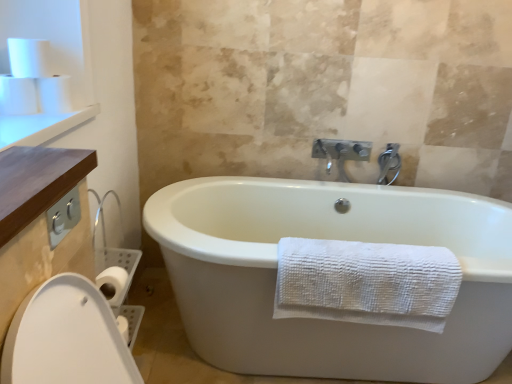
What do you see at coordinates (17, 96) in the screenshot?
I see `white matte toilet paper at upper left, placed as the third toilet paper when sorted from right to left` at bounding box center [17, 96].

In order to face white matte toilet paper at upper left, which is counted as the third toilet paper, starting from the left, should I rotate leftwards or rightwards?

It's best to rotate left around 24.949 degrees.

This screenshot has height=384, width=512. What do you see at coordinates (55, 94) in the screenshot?
I see `white matte toilet paper at upper left, which is counted as the third toilet paper, starting from the left` at bounding box center [55, 94].

Where is `silver metallic faucet at upper center`? This screenshot has width=512, height=384. silver metallic faucet at upper center is located at coordinates (389, 163).

This screenshot has height=384, width=512. Identify the location of white matte toilet paper at upper left, placed as the third toilet paper when sorted from right to left. (17, 96).

Is wooden counter at upper left, which is counted as the second counter top, starting from the bottom, located within white textured towel at lower center?

No, wooden counter at upper left, which is counted as the second counter top, starting from the bottom, is not surrounded by white textured towel at lower center.

Is white textured towel at lower center wider than wooden counter at upper left, placed as the second counter top when sorted from right to left?

No, white textured towel at lower center is not wider than wooden counter at upper left, placed as the second counter top when sorted from right to left.

From the image's perspective, would you say white textured towel at lower center is shown under wooden counter at upper left, which appears as the first counter top when viewed from the left?

Yes, from the image's perspective, white textured towel at lower center is below wooden counter at upper left, which appears as the first counter top when viewed from the left.

From the white textured towel at lower center, count 1st counter tops forward and point to it. Please provide its 2D coordinates.

[(40, 126)]

From a real-world perspective, which object rests below the other?

brown wood counter at upper left, acting as the second counter top starting from the left.

Measure the distance between wooden counter at upper left, arranged as the 1th counter top when viewed from the top, and brown wood counter at upper left, marked as the 1th counter top in a right-to-left arrangement.

wooden counter at upper left, arranged as the 1th counter top when viewed from the top, and brown wood counter at upper left, marked as the 1th counter top in a right-to-left arrangement, are 13.12 inches apart.

Between wooden counter at upper left, placed as the second counter top when sorted from right to left, and brown wood counter at upper left, marked as the 1th counter top in a right-to-left arrangement, which one has larger width?

Wider between the two is wooden counter at upper left, placed as the second counter top when sorted from right to left.

Relative to brown wood counter at upper left, the second counter top positioned from the top, is wooden counter at upper left, the 1th counter top when ordered from back to front, in front or behind?

Visually, wooden counter at upper left, the 1th counter top when ordered from back to front, is located behind brown wood counter at upper left, the second counter top positioned from the top.

Considering the sizes of objects brown wood counter at upper left, the first counter top viewed from the front, and wooden counter at upper left, placed as the second counter top when sorted from right to left, in the image provided, who is thinner, brown wood counter at upper left, the first counter top viewed from the front, or wooden counter at upper left, placed as the second counter top when sorted from right to left,?

With smaller width is brown wood counter at upper left, the first counter top viewed from the front.

Considering the positions of objects brown wood counter at upper left, which appears as the 2th counter top when viewed from the back, and wooden counter at upper left, arranged as the 1th counter top when viewed from the top, in the image provided, who is more to the left, brown wood counter at upper left, which appears as the 2th counter top when viewed from the back, or wooden counter at upper left, arranged as the 1th counter top when viewed from the top,?

wooden counter at upper left, arranged as the 1th counter top when viewed from the top, is more to the left.

From the image's perspective, relative to wooden counter at upper left, the 2th counter top in the front-to-back sequence, is brown wood counter at upper left, marked as the 1th counter top in a right-to-left arrangement, above or below?

Clearly, from the image's perspective, brown wood counter at upper left, marked as the 1th counter top in a right-to-left arrangement, is below wooden counter at upper left, the 2th counter top in the front-to-back sequence.

Consider the image. Is brown wood counter at upper left, marked as the 1th counter top in a right-to-left arrangement, oriented towards wooden counter at upper left, the 1th counter top when ordered from back to front?

No.

Can we say silver metallic faucet at upper center lies outside white matte toilet paper at upper left, which appears as the first toilet paper when viewed from the left?

Yes, silver metallic faucet at upper center is outside of white matte toilet paper at upper left, which appears as the first toilet paper when viewed from the left.

Is silver metallic faucet at upper center at the right side of white matte toilet paper at upper left, placed as the third toilet paper when sorted from right to left?

Correct, you'll find silver metallic faucet at upper center to the right of white matte toilet paper at upper left, placed as the third toilet paper when sorted from right to left.

From a real-world perspective, starting from the silver metallic faucet at upper center, which toilet paper is the 2nd one vertically above it? Please provide its 2D coordinates.

[(17, 96)]

Is silver metallic faucet at upper center aimed at white matte toilet paper at upper left, placed as the third toilet paper when sorted from right to left?

No, silver metallic faucet at upper center is not turned towards white matte toilet paper at upper left, placed as the third toilet paper when sorted from right to left.

Are silver metallic faucet at upper center and wooden counter at upper left, placed as the second counter top when sorted from right to left, located far from each other?

Yes, silver metallic faucet at upper center and wooden counter at upper left, placed as the second counter top when sorted from right to left, are located far from each other.

From their relative heights in the image, would you say silver metallic faucet at upper center is taller or shorter than wooden counter at upper left, the 2th counter top in the front-to-back sequence?

silver metallic faucet at upper center is taller than wooden counter at upper left, the 2th counter top in the front-to-back sequence.

Which is in front, point (395, 168) or point (41, 114)?

The point (41, 114) is closer to the camera.

From the image's perspective, is silver metallic faucet at upper center over wooden counter at upper left, arranged as the 1th counter top when viewed from the top?

Actually, silver metallic faucet at upper center appears below wooden counter at upper left, arranged as the 1th counter top when viewed from the top, in the image.

Is white matte toilet paper at upper left, which appears as the first toilet paper when viewed from the left, completely or partially inside brown wood counter at upper left, marked as the 1th counter top in a right-to-left arrangement?

No, white matte toilet paper at upper left, which appears as the first toilet paper when viewed from the left, is located outside of brown wood counter at upper left, marked as the 1th counter top in a right-to-left arrangement.

In the scene shown: From the image's perspective, would you say brown wood counter at upper left, which is the 1th counter top in bottom-to-top order, is shown under white matte toilet paper at upper left, which appears as the first toilet paper when viewed from the left?

Yes, from the image's perspective, brown wood counter at upper left, which is the 1th counter top in bottom-to-top order, is beneath white matte toilet paper at upper left, which appears as the first toilet paper when viewed from the left.

Is brown wood counter at upper left, which is the 1th counter top in bottom-to-top order, in front of or behind white matte toilet paper at upper left, which appears as the first toilet paper when viewed from the left, in the image?

In the image, brown wood counter at upper left, which is the 1th counter top in bottom-to-top order, appears in front of white matte toilet paper at upper left, which appears as the first toilet paper when viewed from the left.

Does white matte toilet paper at upper left, placed as the third toilet paper when sorted from right to left, have a lesser height compared to brown wood counter at upper left, which is the 1th counter top in bottom-to-top order?

No, white matte toilet paper at upper left, placed as the third toilet paper when sorted from right to left, is not shorter than brown wood counter at upper left, which is the 1th counter top in bottom-to-top order.

Is brown wood counter at upper left, which appears as the 2th counter top when viewed from the back, inside white matte toilet paper at upper left, placed as the third toilet paper when sorted from right to left?

No, brown wood counter at upper left, which appears as the 2th counter top when viewed from the back, is located outside of white matte toilet paper at upper left, placed as the third toilet paper when sorted from right to left.

Consider the image. In the image, is white matte toilet paper at upper left, placed as the third toilet paper when sorted from right to left, positioned in front of or behind brown wood counter at upper left, marked as the 1th counter top in a right-to-left arrangement?

white matte toilet paper at upper left, placed as the third toilet paper when sorted from right to left, is positioned farther from the viewer than brown wood counter at upper left, marked as the 1th counter top in a right-to-left arrangement.

Which is more to the right, white matte toilet paper at upper left, placed as the third toilet paper when sorted from right to left, or brown wood counter at upper left, the first counter top viewed from the front?

Positioned to the right is brown wood counter at upper left, the first counter top viewed from the front.

Locate an element on the screen. Image resolution: width=512 pixels, height=384 pixels. the 2nd counter top counting from the left side of the white textured towel at lower center is located at coordinates (40, 126).

Where is `counter top that is above the brown wood counter at upper left, which appears as the 2th counter top when viewed from the back (from the image's perspective)`? counter top that is above the brown wood counter at upper left, which appears as the 2th counter top when viewed from the back (from the image's perspective) is located at coordinates (x=40, y=126).

Considering their positions, is white matte toilet paper at upper left, the 2th toilet paper positioned from the left, positioned closer to white matte toilet paper at upper left, which is counted as the third toilet paper, starting from the left, than white textured towel at lower center?

white matte toilet paper at upper left, the 2th toilet paper positioned from the left.

From the image, which object appears to be nearer to white matte toilet paper at upper left, placed as the third toilet paper when sorted from right to left, white textured towel at lower center or white matte toilet paper at upper left, which is counted as the third toilet paper, starting from the left?

white matte toilet paper at upper left, which is counted as the third toilet paper, starting from the left, is closer to white matte toilet paper at upper left, placed as the third toilet paper when sorted from right to left.

Looking at the image, which one is located further to white matte toilet paper at upper left, the 2th toilet paper positioned from the left, white matte toilet paper at upper left, which is the 1th toilet paper from right to left, or brown wood counter at upper left, the second counter top positioned from the top?

brown wood counter at upper left, the second counter top positioned from the top.

Which object lies nearer to the anchor point brown wood counter at upper left, which appears as the 2th counter top when viewed from the back, white textured towel at lower center or silver metallic faucet at upper center?

The object closer to brown wood counter at upper left, which appears as the 2th counter top when viewed from the back, is white textured towel at lower center.

Estimate the real-world distances between objects in this image. Which object is further from white matte toilet paper at upper left, which is the 1th toilet paper from right to left, brown wood counter at upper left, the second counter top positioned from the top, or white matte toilet paper at upper left, the 2th toilet paper positioned from the left?

Among the two, brown wood counter at upper left, the second counter top positioned from the top, is located further to white matte toilet paper at upper left, which is the 1th toilet paper from right to left.

Consider the image. Based on their spatial positions, is white matte toilet paper at upper left, placed as the third toilet paper when sorted from right to left, or silver metallic faucet at upper center further from white textured towel at lower center?

The object further to white textured towel at lower center is white matte toilet paper at upper left, placed as the third toilet paper when sorted from right to left.

Based on their spatial positions, is silver metallic faucet at upper center or white matte toilet paper at upper left, the 2th toilet paper positioned from the left, closer to brown wood counter at upper left, which appears as the 2th counter top when viewed from the back?

white matte toilet paper at upper left, the 2th toilet paper positioned from the left.

Estimate the real-world distances between objects in this image. Which object is further from white textured towel at lower center, white matte toilet paper at upper left, the 2th toilet paper positioned from the left, or white matte toilet paper at upper left, which is counted as the third toilet paper, starting from the left?

white matte toilet paper at upper left, the 2th toilet paper positioned from the left.

Where is `toilet paper between white matte toilet paper at upper left, the 2th toilet paper positioned from the left, and white matte toilet paper at upper left, placed as the third toilet paper when sorted from right to left, from top to bottom`? The width and height of the screenshot is (512, 384). toilet paper between white matte toilet paper at upper left, the 2th toilet paper positioned from the left, and white matte toilet paper at upper left, placed as the third toilet paper when sorted from right to left, from top to bottom is located at coordinates (55, 94).

You are a GUI agent. You are given a task and a screenshot of the screen. Output one action in this format:
    pyautogui.click(x=<x>, y=<y>)
    Task: Click on the counter top between brown wood counter at upper left, which is the 1th counter top in bottom-to-top order, and white matte toilet paper at upper left, the 2th toilet paper positioned from the left, from front to back
    
    Given the screenshot: What is the action you would take?
    pyautogui.click(x=40, y=126)

This screenshot has height=384, width=512. I want to click on counter top between brown wood counter at upper left, the first counter top viewed from the front, and white matte toilet paper at upper left, placed as the third toilet paper when sorted from right to left, from front to back, so click(x=40, y=126).

Find the location of `towel situated between white matte toilet paper at upper left, which appears as the first toilet paper when viewed from the left, and silver metallic faucet at upper center from left to right`. towel situated between white matte toilet paper at upper left, which appears as the first toilet paper when viewed from the left, and silver metallic faucet at upper center from left to right is located at coordinates (366, 283).